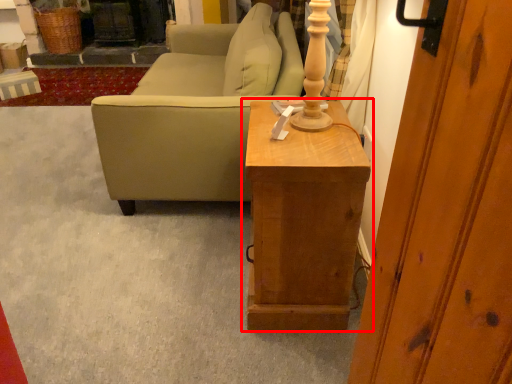
Question: In this image, where is table (annotated by the red box) located relative to studio couch?

Choices:
 (A) left
 (B) right

Answer: (B)